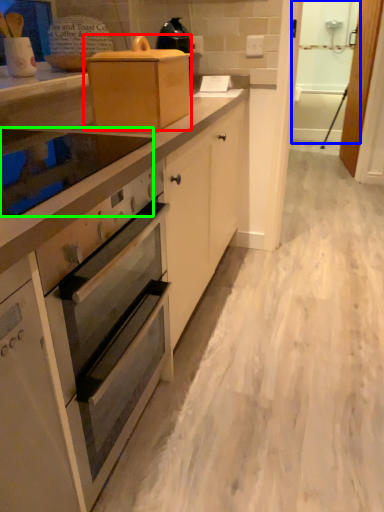
Question: Which object is the closest to the appliance (highlighted by a red box)? Choose among these: screen door (highlighted by a blue box) or home appliance (highlighted by a green box).

Choices:
 (A) screen door
 (B) home appliance

Answer: (B)